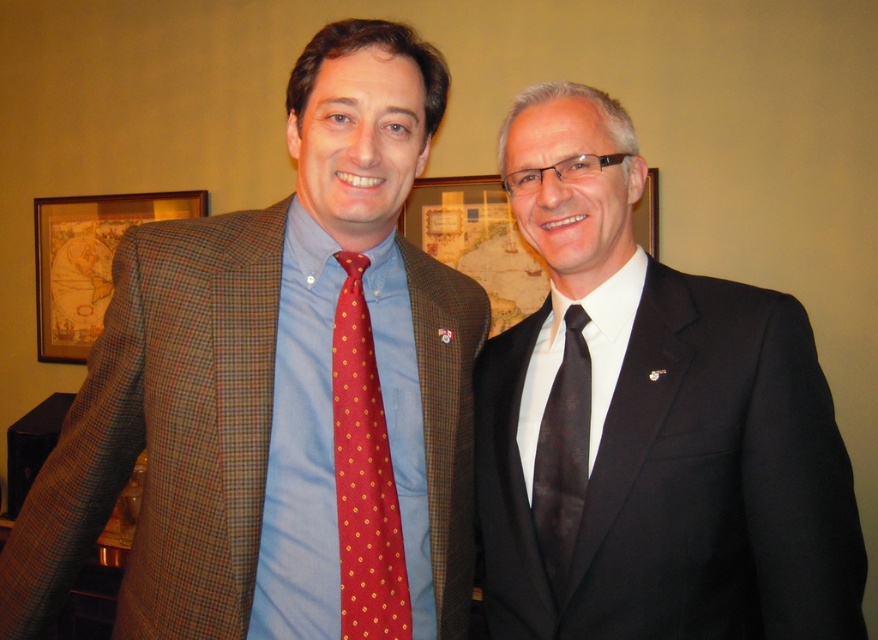
You are a photographer setting up for a group photo. You need to ensure there is enough space between the two men so that their clothing details are clearly visible in the photo. The minimum required distance between them should be 30 centimeters. Based on the current positions shown in the image, will the distance between the matte plaid blazer at left and the matte black suit at right meet this requirement?

The matte plaid blazer at left is 28.14 centimeters from the matte black suit at right. Since 28.14 cm is less than the required 30 cm, the distance does not meet the requirement. They need to move slightly apart to achieve the minimum distance.

You are a photographer at a formal event. You need to adjust the lighting so that the matte black suit at right and the red dotted tie at left are both visible. Which object should you focus on adjusting the light for first?

The matte black suit at right is positioned over red dotted tie at left, so you should focus on adjusting the light for the matte black suit at right first to ensure it doesn not block the visibility of the red dotted tie at left.